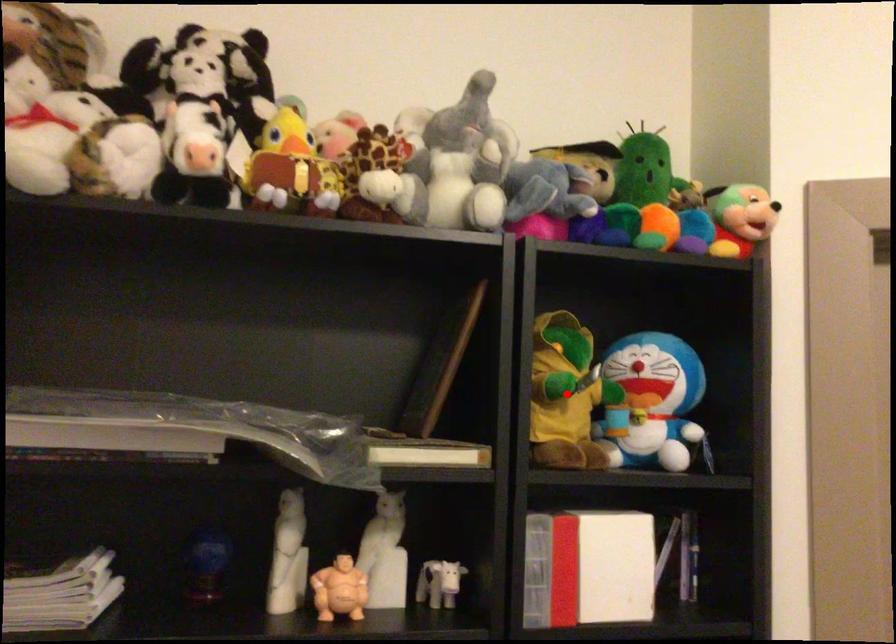
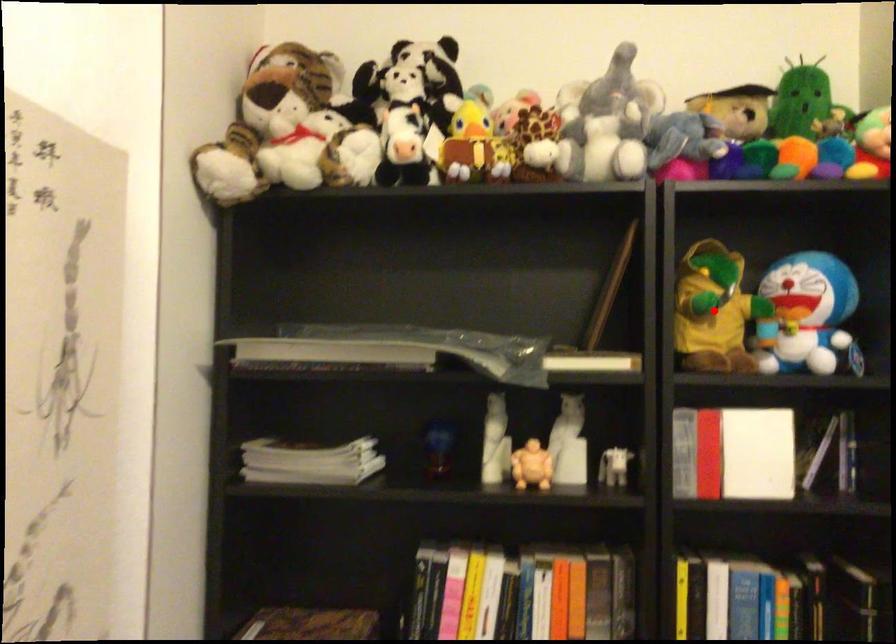
I am providing you with two images of the same scene from different viewpoints. A red point is marked on the first image and another point is marked on the second image. Does the point marked in image1 correspond to the same location as the one in image2?

Yes